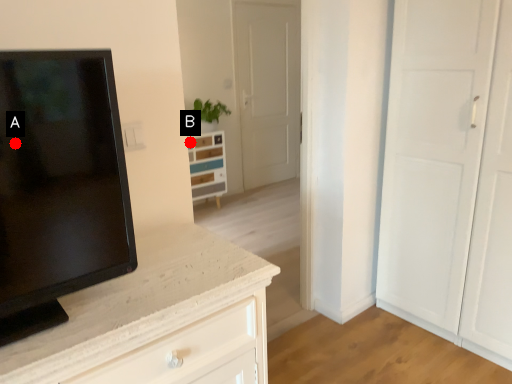
Question: Two points are circled on the image, labeled by A and B beside each circle. Which point is farther to the camera?

Choices:
 (A) A is further
 (B) B is further

Answer: (B)